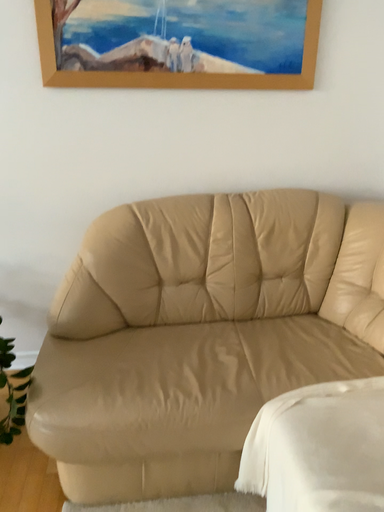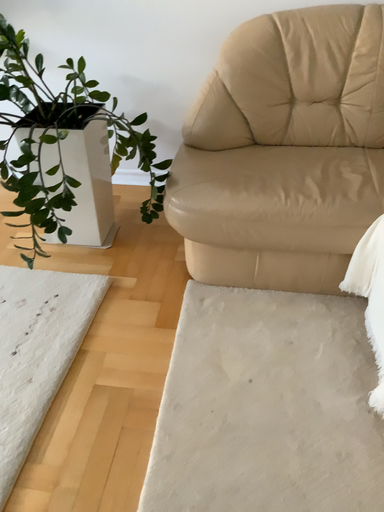
Question: Which way did the camera rotate in the video?

Choices:
 (A) rotated upward
 (B) rotated downward

Answer: (B)